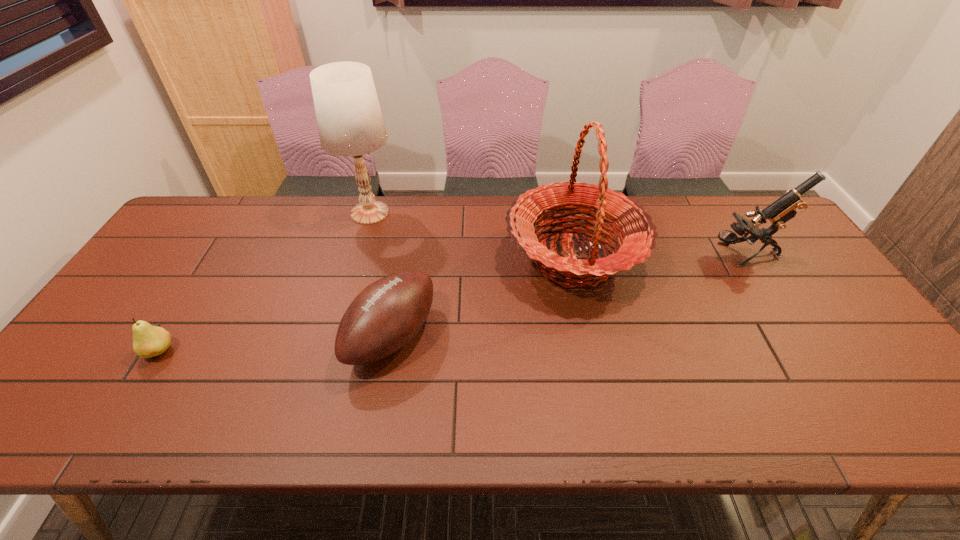
The image size is (960, 540). I want to click on lamp, so click(350, 123).

At what (x,y) coordinates should I click in order to perform the action: click on basket. Please return your answer as a coordinate pair (x, y). Image resolution: width=960 pixels, height=540 pixels. Looking at the image, I should click on (636, 231).

The width and height of the screenshot is (960, 540). Identify the location of the third shortest object. (785, 208).

The image size is (960, 540). What are the coordinates of `the rightmost object` in the screenshot? It's located at (785, 208).

Locate an element on the screen. The image size is (960, 540). the fourth tallest object is located at coordinates (386, 315).

Identify the location of the leftmost object. (148, 341).

Where is `pear`? Image resolution: width=960 pixels, height=540 pixels. pear is located at coordinates (148, 341).

Identify the location of free spot located on the left of the lamp. This screenshot has height=540, width=960. (221, 213).

In order to click on vacant region located on the left of the second object from right to left in this screenshot , I will do `click(375, 259)`.

Find the location of `free location located through the eyepiece of the rightmost object`. free location located through the eyepiece of the rightmost object is located at coordinates coord(680,255).